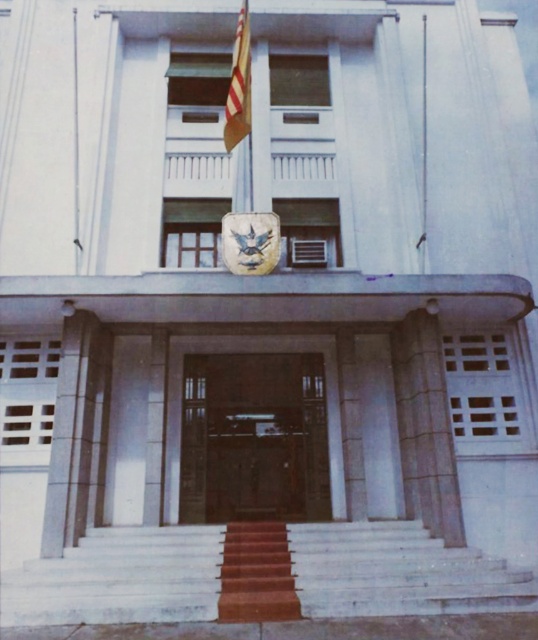
Who is positioned more to the right, striped fabric flag at upper center or metallic flag pole at center?

metallic flag pole at center is more to the right.

Is point (232, 86) closer to camera compared to point (423, 266)?

No, it is behind (423, 266).

This screenshot has width=538, height=640. I want to click on striped fabric flag at upper center, so click(x=238, y=84).

Identify the location of striped fabric flag at upper center. This screenshot has height=640, width=538. (238, 84).

Which of these two, brown wooden door at center or striped fabric flag at upper center, stands shorter?

Standing shorter between the two is brown wooden door at center.

Is brown wooden door at center taller than striped fabric flag at upper center?

Incorrect, brown wooden door at center's height is not larger of striped fabric flag at upper center's.

Where is `brown wooden door at center`? The height and width of the screenshot is (640, 538). brown wooden door at center is located at coordinates (253, 438).

Is brown wooden door at center to the left of rustic wooden stairs at center from the viewer's perspective?

Correct, you'll find brown wooden door at center to the left of rustic wooden stairs at center.

Is brown wooden door at center taller than rustic wooden stairs at center?

Correct, brown wooden door at center is much taller as rustic wooden stairs at center.

Between point (307, 376) and point (245, 541), which one is positioned behind?

The point (307, 376) is more distant.

Where is `brown wooden door at center`? The image size is (538, 640). brown wooden door at center is located at coordinates (253, 438).